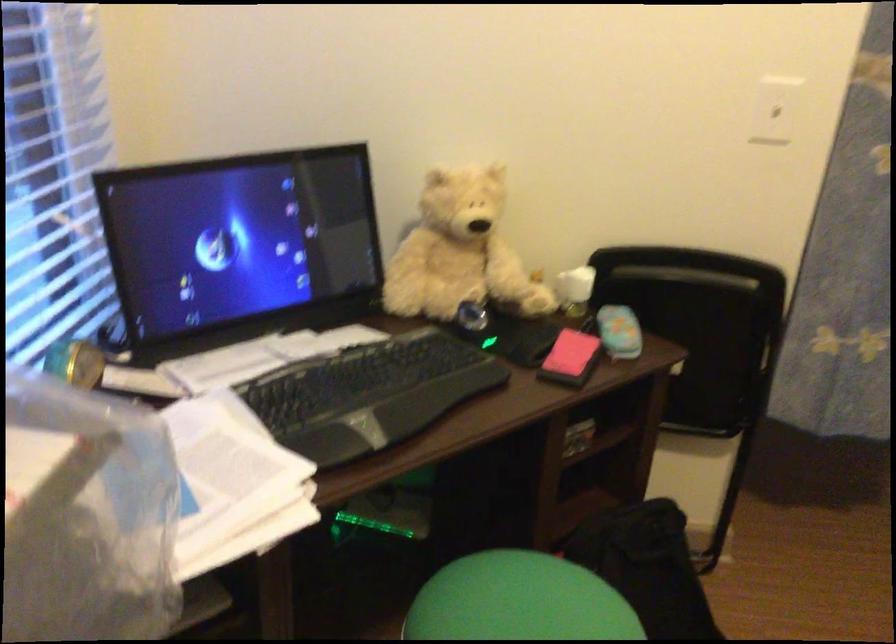
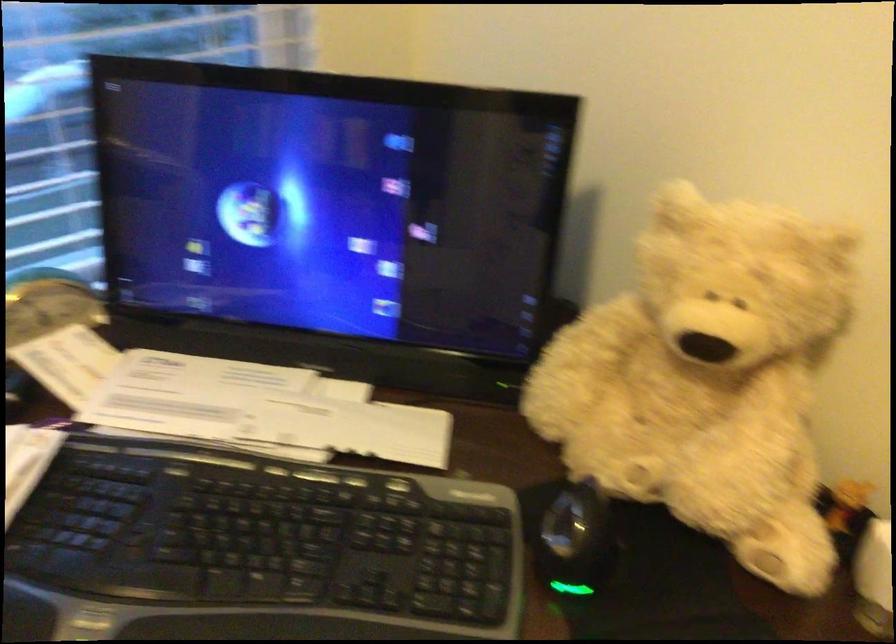
The first image is from the beginning of the video and the second image is from the end. How did the camera likely rotate when shooting the video?

The camera's rotation is toward left-down.